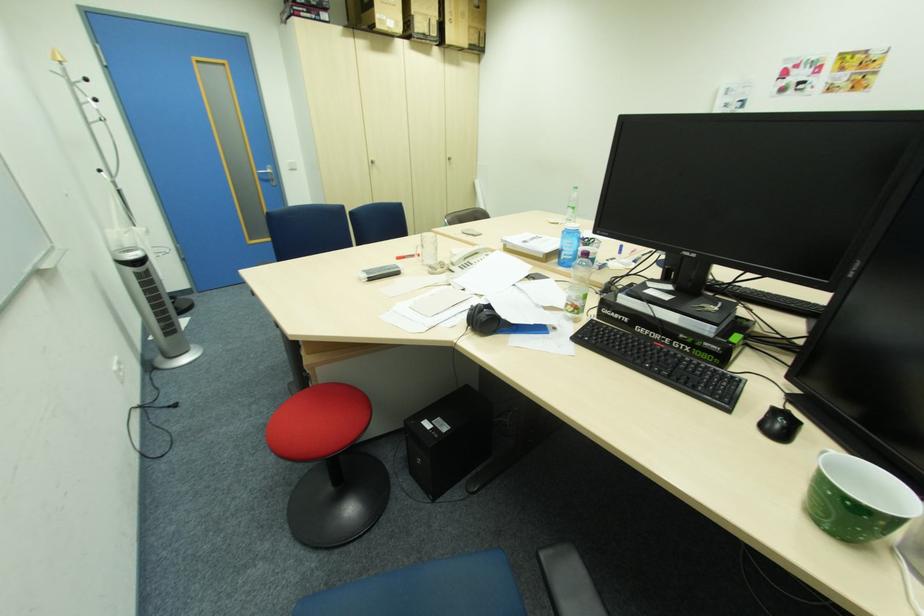
Where would you sitting on the red chair sitting surface? Please return your answer as a coordinate pair (x, y).

(319, 422)